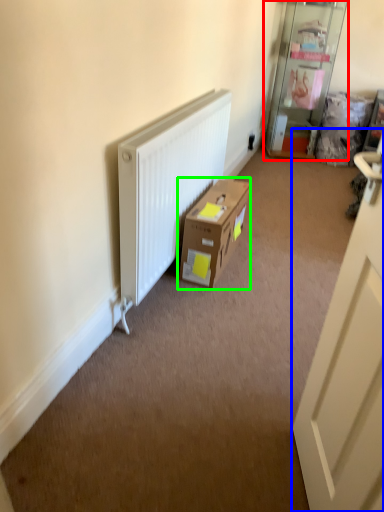
Question: Based on their relative distances, which object is farther from shelf (highlighted by a red box)? Choose from door (highlighted by a blue box) and box (highlighted by a green box).

Choices:
 (A) door
 (B) box

Answer: (A)